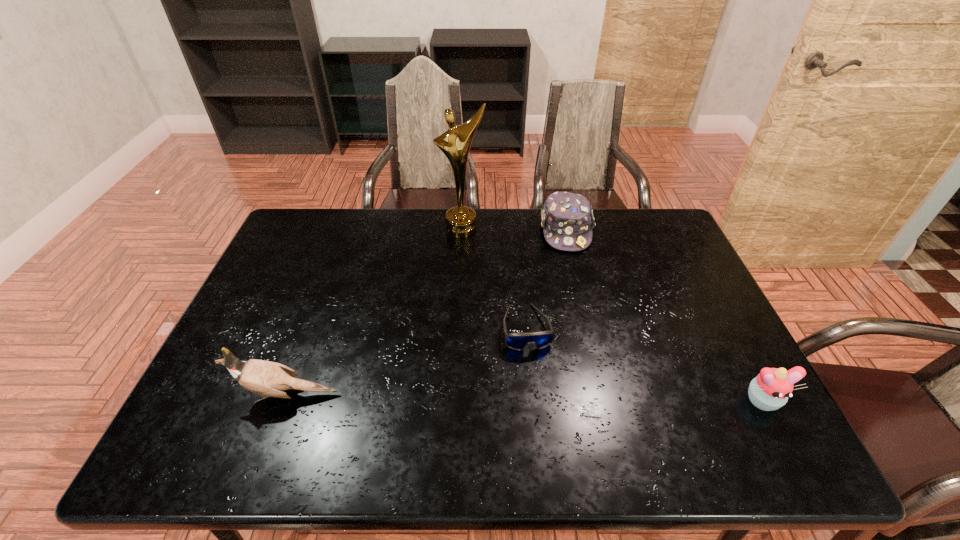
Where is `bird`? The image size is (960, 540). bird is located at coordinates click(266, 378).

At what (x,y) coordinates should I click in order to perform the action: click on the leftmost object. Please return your answer as a coordinate pair (x, y). The image size is (960, 540). Looking at the image, I should click on (266, 378).

Identify the location of cupcake. This screenshot has height=540, width=960. pos(770,390).

I want to click on the third farthest object, so click(x=518, y=341).

Locate an element on the screen. sunglasses is located at coordinates (518, 341).

I want to click on the fourth object from right to left, so click(455, 143).

Locate an element on the screen. The image size is (960, 540). award is located at coordinates (455, 143).

At what (x,y) coordinates should I click in order to perform the action: click on the second object from right to left. Please return your answer as a coordinate pair (x, y). The height and width of the screenshot is (540, 960). Looking at the image, I should click on (567, 220).

Find the location of a particular element. vacant space situated 0.100m on the front-facing side of the sunglasses is located at coordinates (539, 387).

Image resolution: width=960 pixels, height=540 pixels. Identify the location of vacant position located 0.070m on the front-facing side of the sunglasses. (536, 376).